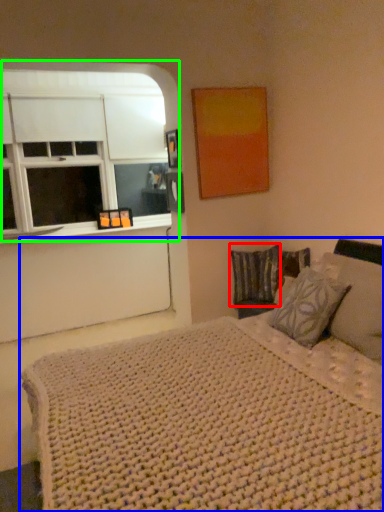
Question: Considering the real-world distances, which object is closest to pillow (highlighted by a red box)? bed (highlighted by a blue box) or window (highlighted by a green box).

Choices:
 (A) bed
 (B) window

Answer: (A)